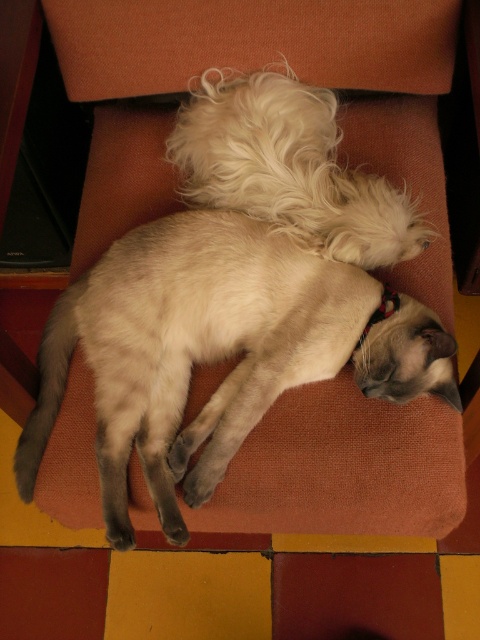
Question: Is silky white cat at center further to camera compared to white fluffy dog at upper center?

Choices:
 (A) no
 (B) yes

Answer: (A)

Question: Observing the image, what is the correct spatial positioning of silky white cat at center in reference to white fluffy dog at upper center?

Choices:
 (A) left
 (B) right

Answer: (A)

Question: Among these points, which one is nearest to the camera?

Choices:
 (A) (25, 497)
 (B) (257, 100)

Answer: (A)

Question: Is silky white cat at center positioned behind white fluffy dog at upper center?

Choices:
 (A) no
 (B) yes

Answer: (A)